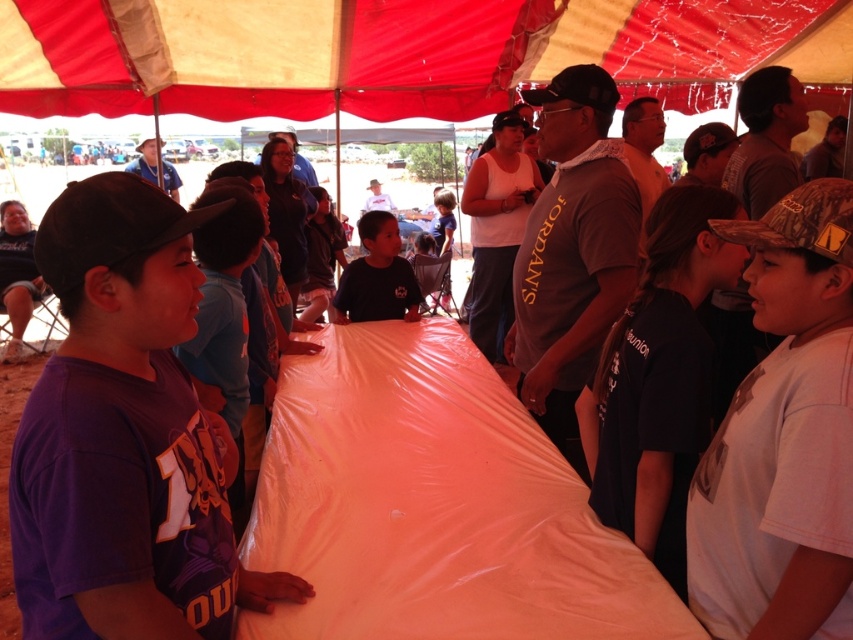
You are standing at the center of the large red and beige tent in the image. Looking up, you notice a point marked at coordinates (390, 52). What object is located at this coordinate?

The point at coordinates (390, 52) corresponds to the red fabric canopy at upper center.

You are a photographer at the event and want to capture a photo that includes both the red fabric canopy at upper center and the dark blue shirt at center. Based on their positions, which object should you position to the left side of your camera frame to include both in the shot?

To include both the red fabric canopy at upper center and the dark blue shirt at center in the photo, you should position the dark blue shirt at center on the left side of the camera frame since the red fabric canopy at upper center is to the right of it.